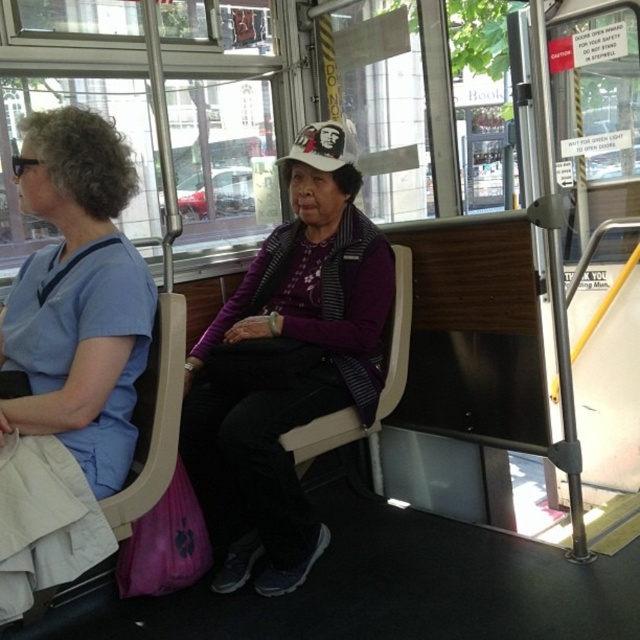
Is purple matte sweater at center to the right of blue scrubs at left from the viewer's perspective?

Yes, purple matte sweater at center is to the right of blue scrubs at left.

Which is below, purple matte sweater at center or blue scrubs at left?

purple matte sweater at center is lower down.

Describe the element at coordinates (296, 376) in the screenshot. The width and height of the screenshot is (640, 640). I see `purple matte sweater at center` at that location.

Locate an element on the screen. The height and width of the screenshot is (640, 640). purple matte sweater at center is located at coordinates (296, 376).